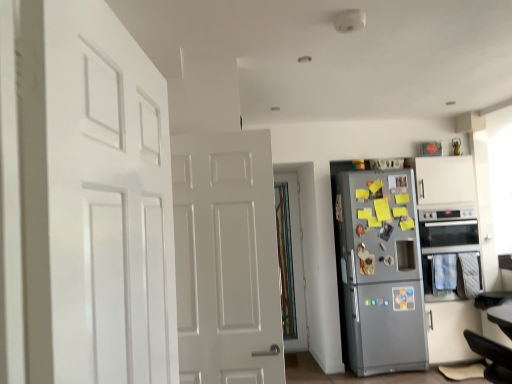
Question: Are black leather swivel chair at lower right and satin silver fridge at right located far from each other?

Choices:
 (A) yes
 (B) no

Answer: (A)

Question: Is satin silver fridge at right a part of black leather swivel chair at lower right?

Choices:
 (A) no
 (B) yes

Answer: (A)

Question: From a real-world perspective, is black leather swivel chair at lower right located higher than satin silver fridge at right?

Choices:
 (A) yes
 (B) no

Answer: (B)

Question: Is black leather swivel chair at lower right facing towards satin silver fridge at right?

Choices:
 (A) yes
 (B) no

Answer: (B)

Question: Considering the relative sizes of black leather swivel chair at lower right and satin silver fridge at right in the image provided, is black leather swivel chair at lower right thinner than satin silver fridge at right?

Choices:
 (A) no
 (B) yes

Answer: (B)

Question: Considering the relative sizes of black leather swivel chair at lower right and satin silver fridge at right in the image provided, is black leather swivel chair at lower right bigger than satin silver fridge at right?

Choices:
 (A) no
 (B) yes

Answer: (A)

Question: Would you say satin silver fridge at right contains silver metallic oven at right?

Choices:
 (A) no
 (B) yes

Answer: (A)

Question: Can you confirm if satin silver fridge at right is shorter than silver metallic oven at right?

Choices:
 (A) no
 (B) yes

Answer: (A)

Question: Can you confirm if satin silver fridge at right is thinner than silver metallic oven at right?

Choices:
 (A) yes
 (B) no

Answer: (A)

Question: Is satin silver fridge at right oriented towards silver metallic oven at right?

Choices:
 (A) yes
 (B) no

Answer: (B)

Question: Is satin silver fridge at right at the left side of silver metallic oven at right?

Choices:
 (A) no
 (B) yes

Answer: (B)

Question: From a real-world perspective, is satin silver fridge at right physically above silver metallic oven at right?

Choices:
 (A) yes
 (B) no

Answer: (B)

Question: Is silver metallic oven at right positioned behind black leather swivel chair at lower right?

Choices:
 (A) yes
 (B) no

Answer: (A)